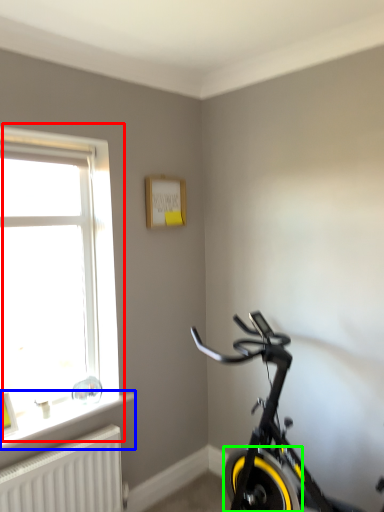
Question: Which object is positioned closest to window (highlighted by a red box)? Select from window sill (highlighted by a blue box) and bicycle wheel (highlighted by a green box).

Choices:
 (A) window sill
 (B) bicycle wheel

Answer: (A)